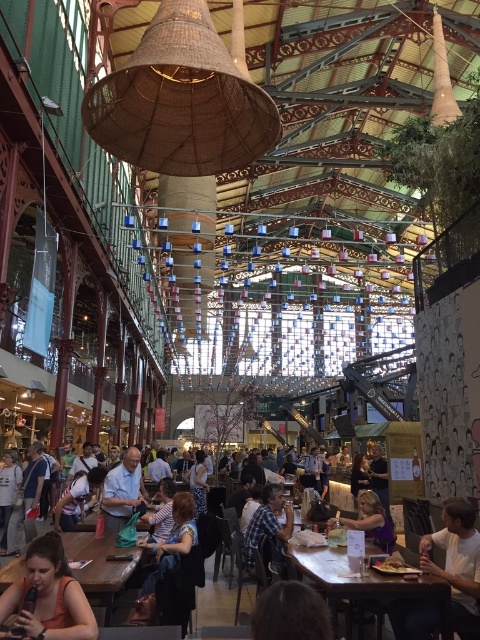
Question: Does brown hair at lower center come in front of golden crispy fries at lower right?

Choices:
 (A) no
 (B) yes

Answer: (B)

Question: Is brown wooden table at lower left wider than plaid shirt at center?

Choices:
 (A) yes
 (B) no

Answer: (A)

Question: Which point is closer to the camera?

Choices:
 (A) (128, 563)
 (B) (396, 616)
 (C) (184, 524)
 (D) (361, 518)

Answer: (B)

Question: Among these objects, which one is nearest to the camera?

Choices:
 (A) purple matte dress at lower right
 (B) light blue shirt at center
 (C) striped fabric shirt at center

Answer: (C)

Question: Is wooden table at lower right below golden crispy fries at lower right?

Choices:
 (A) no
 (B) yes

Answer: (B)

Question: Which point is farther to the camera?

Choices:
 (A) (82, 538)
 (B) (376, 563)

Answer: (A)